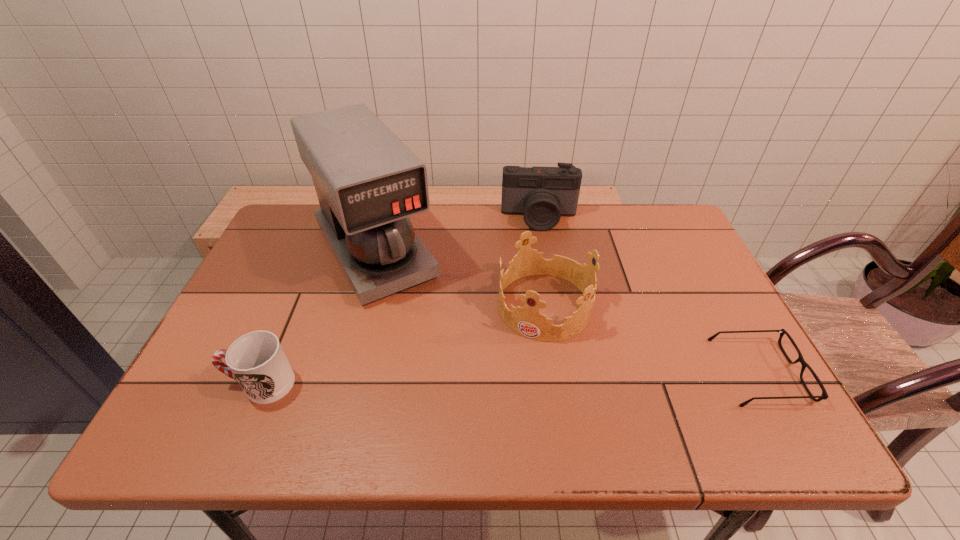
The image size is (960, 540). I want to click on vacant spot on the desktop that is between the cup and the shortest object and is positioned on the front-facing side of the tiara, so click(x=510, y=377).

Image resolution: width=960 pixels, height=540 pixels. What are the coordinates of `vacant space on the desktop that is between the cup and the shortest object and is positioned on the carafe side of the tallest object` in the screenshot? It's located at (458, 379).

You are a GUI agent. You are given a task and a screenshot of the screen. Output one action in this format:
    pyautogui.click(x=<x>, y=<y>)
    Task: Click on the free space on the desktop that is between the cup and the shortest object and is positioned at the lens of the camera
    This screenshot has width=960, height=540.
    Given the screenshot: What is the action you would take?
    pyautogui.click(x=550, y=377)